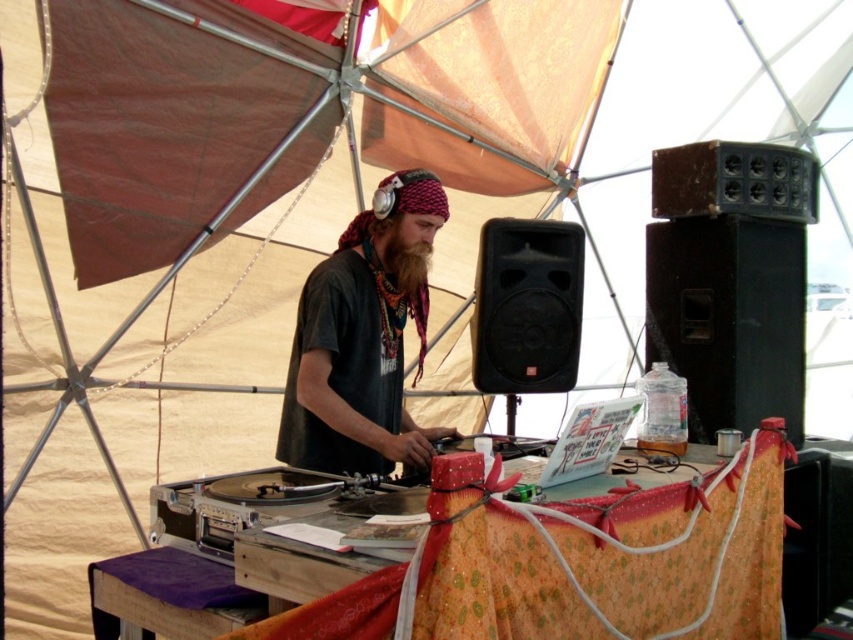
You are a sound technician who needs to place a microphone stand exactly 0.1 units to the left of the black plastic speaker at right. What coordinate should you set for the microphone stand?

The microphone stand should be placed at coordinate point (x=729, y=253), which is 0.1 units to the left of the black plastic speaker at right located at (x=729, y=317).

You are standing at the point marked as point (372, 198) in the tent. You want to walk straight towards the DJ setup. How far will you have to walk to reach the DJ setup?

The distance between point (372, 198) and the DJ setup is 10.78 feet, so you will have to walk 10.78 feet to reach the DJ setup.

You are a sound technician at a music festival. You need to adjust the volume of the speaker so that it reaches the DJ clearly. The speaker has a maximum range of 6 feet. Based on the scene, can the black plastic speaker at right be heard by the brown fuzzy beard at center?

The black plastic speaker at right is 6.50 feet from the brown fuzzy beard at center. Since the speaker has a maximum range of 6 feet, it cannot reach the DJ clearly.